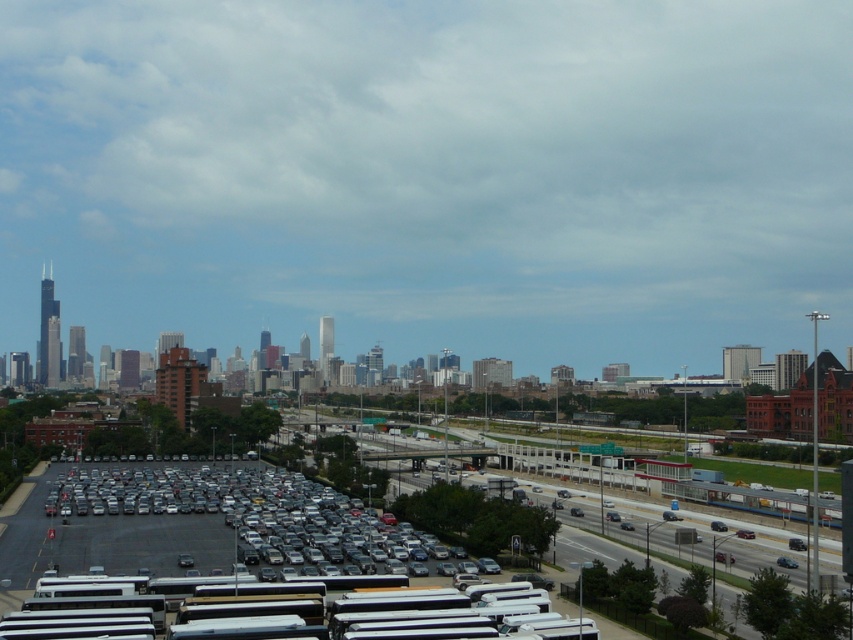
Question: Can you confirm if metallic blue sedan at center is wider than matte silver sedan at center?

Choices:
 (A) yes
 (B) no

Answer: (B)

Question: Among these objects, which one is nearest to the camera?

Choices:
 (A) matte black car at lower left
 (B) matte silver sedan at center
 (C) metallic blue sedan at center
 (D) metallic gray cars at lower center

Answer: (D)

Question: Does matte black car at lower left come behind matte silver sedan at center?

Choices:
 (A) no
 (B) yes

Answer: (A)

Question: Which of these objects is positioned farthest from the metallic blue sedan at center?

Choices:
 (A) metallic gray cars at lower center
 (B) matte black car at lower left
 (C) matte silver sedan at center

Answer: (B)

Question: Observing the image, what is the correct spatial positioning of metallic blue sedan at center in reference to matte silver sedan at center?

Choices:
 (A) below
 (B) above

Answer: (B)

Question: Which point is farther from the camera taking this photo?

Choices:
 (A) (750, 532)
 (B) (787, 560)
 (C) (242, 515)
 (D) (259, 484)

Answer: (D)